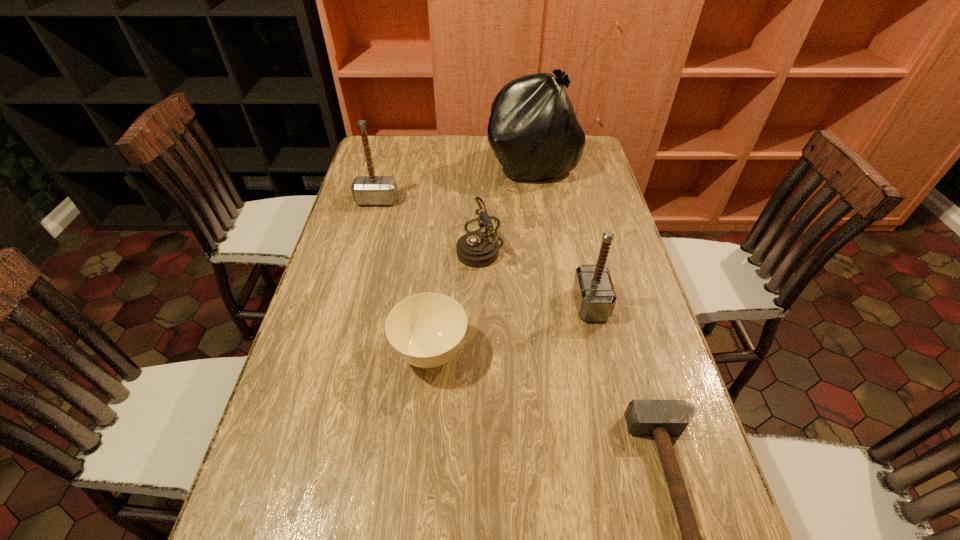
Identify the location of plastic bag. (533, 130).

This screenshot has width=960, height=540. In order to click on the farthest object in this screenshot , I will do `click(533, 130)`.

I want to click on the leftmost hammer, so click(367, 190).

In order to click on the fifth nearest object in this screenshot , I will do `click(367, 190)`.

This screenshot has width=960, height=540. I want to click on the second nearest hammer, so click(595, 297).

This screenshot has height=540, width=960. I want to click on the second shortest hammer, so click(x=595, y=297).

Identify the location of telephone. The image size is (960, 540). (477, 249).

Locate an element on the screen. The image size is (960, 540). sugar bowl is located at coordinates (426, 330).

Where is `vacant space located 0.250m on the left of the farthest object`? The height and width of the screenshot is (540, 960). vacant space located 0.250m on the left of the farthest object is located at coordinates (418, 165).

Identify the location of vacant point located 0.170m on the striking surface of the leftmost object. This screenshot has height=540, width=960. point(366,242).